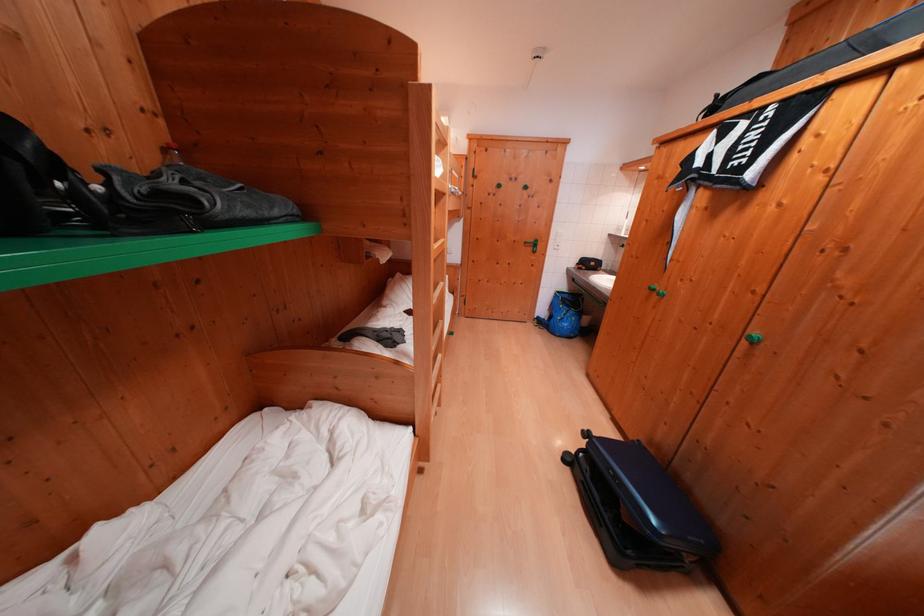
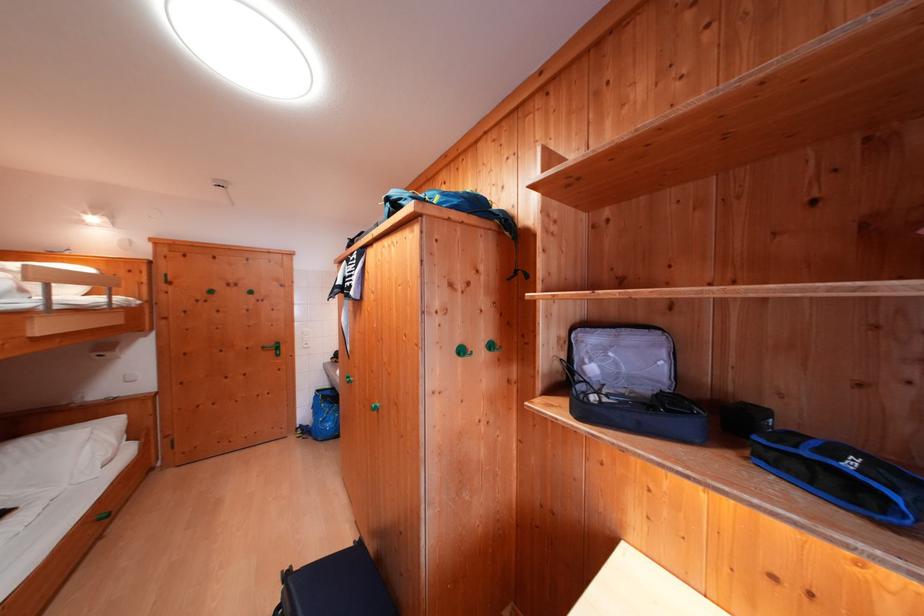
Find the pixel in the second image that matches (x=594, y=439) in the first image.

(296, 578)